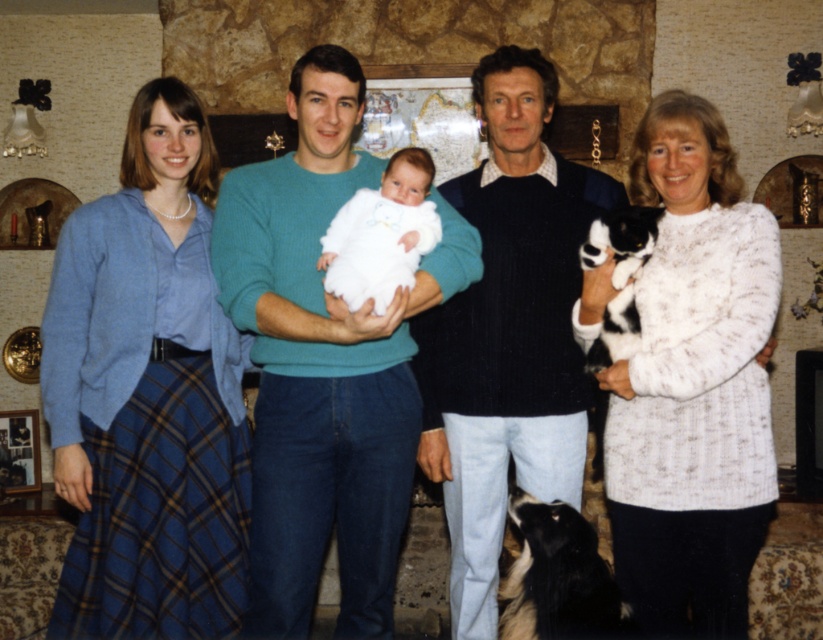
Where is `white knitted sweater at right`? white knitted sweater at right is located at coordinates (693, 385).

You are a GUI agent. You are given a task and a screenshot of the screen. Output one action in this format:
    pyautogui.click(x=<x>, y=<y>)
    Task: Click on the white knitted sweater at right
    
    Given the screenshot: What is the action you would take?
    pyautogui.click(x=693, y=385)

Is point (323, 458) farther from viewer compared to point (482, 330)?

No, it is in front of (482, 330).

Does green knitted sweater at center have a greater height compared to dark blue sweater at center?

No.

Is point (291, 512) positioned behind point (524, 61)?

No, it is not.

Image resolution: width=823 pixels, height=640 pixels. Identify the location of green knitted sweater at center. (324, 364).

Does black and white fur at lower right appear under white fluffy baby at center?

Correct, black and white fur at lower right is located below white fluffy baby at center.

What do you see at coordinates (558, 579) in the screenshot? I see `black and white fur at lower right` at bounding box center [558, 579].

Find the location of a particular element. black and white fur at lower right is located at coordinates (558, 579).